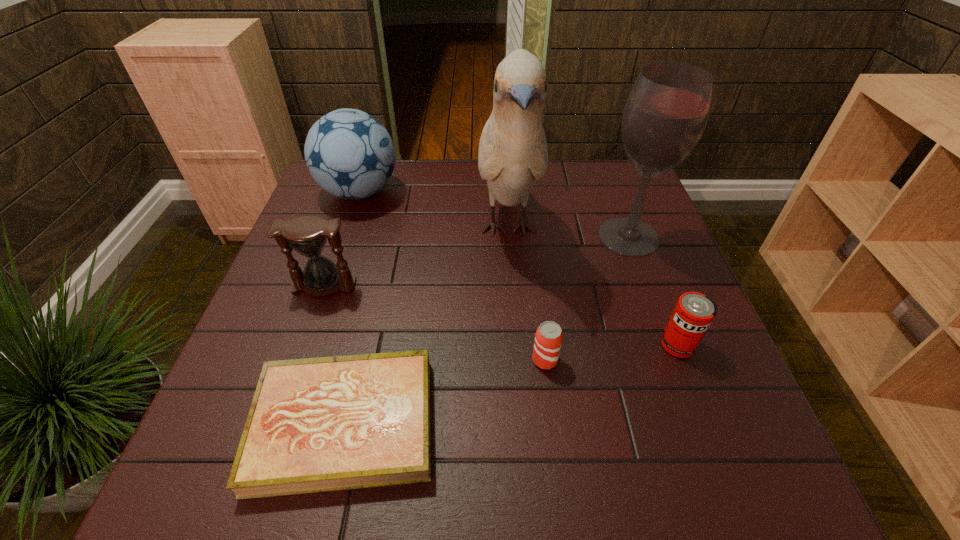
Locate an element on the screen. The width and height of the screenshot is (960, 540). free point that satisfies the following two spatial constraints: 1. on the back side of the alcohol; 2. on the left side of the shortest object is located at coordinates (388, 237).